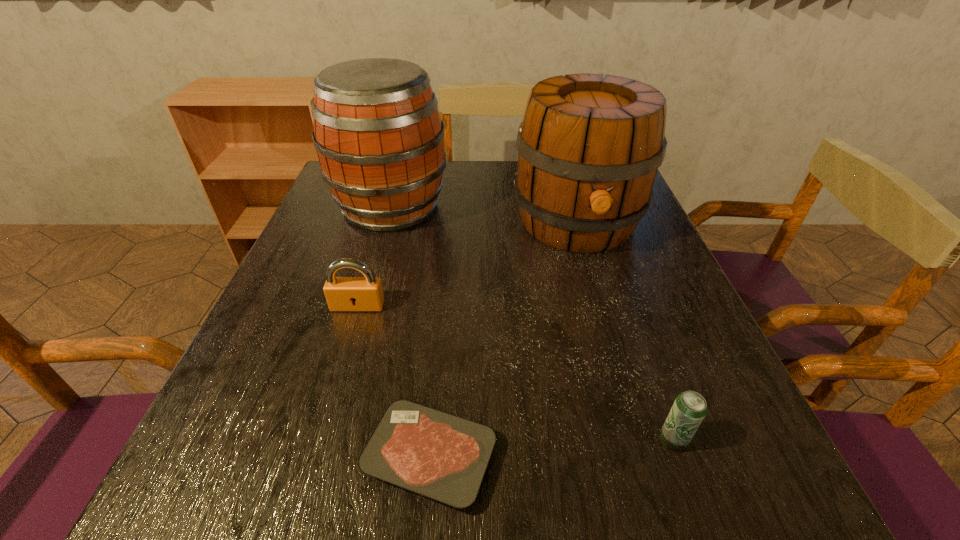
Where is `free space between the right cider and the beer can`? This screenshot has height=540, width=960. free space between the right cider and the beer can is located at coordinates (625, 332).

This screenshot has height=540, width=960. I want to click on blank region between the right cider and the shortest object, so click(503, 340).

This screenshot has height=540, width=960. I want to click on vacant space that is in between the left cider and the second shortest object, so click(532, 323).

Locate an element on the screen. the second closest object to the right cider is located at coordinates (365, 293).

This screenshot has height=540, width=960. Identify the location of object that can be found as the second closest to the right cider. (365, 293).

Image resolution: width=960 pixels, height=540 pixels. I want to click on free space that satisfies the following two spatial constraints: 1. to unlock the steak from the front; 2. on the right side of the third farthest object, so click(313, 457).

At what (x,y) coordinates should I click in order to perform the action: click on free space that satisfies the following two spatial constraints: 1. to unlock the beer can from the front; 2. on the right side of the padlock. Please return your answer as a coordinate pair (x, y). The width and height of the screenshot is (960, 540). Looking at the image, I should click on (318, 440).

This screenshot has height=540, width=960. Identify the location of vacant space that satisfies the following two spatial constraints: 1. on the side of the right cider where the spigot is located; 2. on the left side of the second shortest object. (640, 440).

Where is `vacant space that satisfies the following two spatial constraints: 1. to unlock the fourth tallest object from the front; 2. on the left side of the padlock`? The image size is (960, 540). vacant space that satisfies the following two spatial constraints: 1. to unlock the fourth tallest object from the front; 2. on the left side of the padlock is located at coordinates (318, 440).

The width and height of the screenshot is (960, 540). I want to click on vacant space that satisfies the following two spatial constraints: 1. to unlock the third farthest object from the front; 2. on the right side of the second shortest object, so click(318, 440).